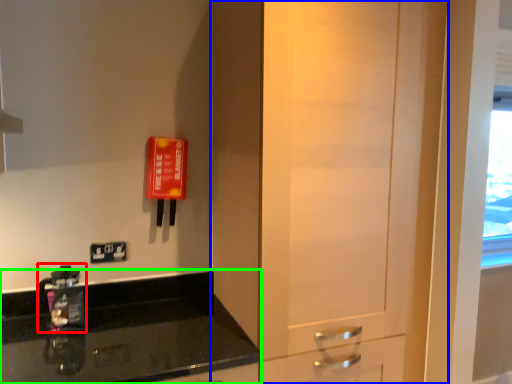
Question: Based on their relative distances, which object is farther from appliance (highlighted by a red box)? Choose from door (highlighted by a blue box) and countertop (highlighted by a green box).

Choices:
 (A) door
 (B) countertop

Answer: (A)